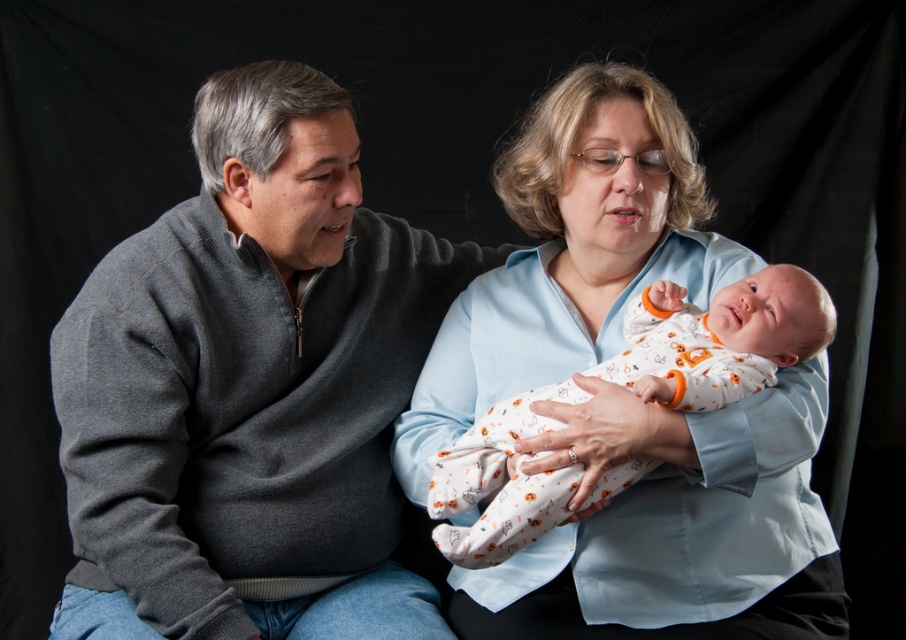
Between point (317, 493) and point (631, 595), which one is positioned in front?

Point (631, 595) is in front.

Does point (393, 584) come farther from viewer compared to point (589, 330)?

Yes, it is behind point (589, 330).

The image size is (906, 640). Identify the location of gray sweater at left. (249, 387).

Does light blue shirt at center have a greater height compared to white cotton onesie at center?

Yes, light blue shirt at center is taller than white cotton onesie at center.

Is light blue shirt at center thinner than white cotton onesie at center?

No.

Which is behind, point (735, 588) or point (564, 401)?

The point (735, 588) is more distant.

The width and height of the screenshot is (906, 640). Identify the location of light blue shirt at center. (675, 525).

Is gray sweater at left taller than white cotton onesie at center?

Correct, gray sweater at left is much taller as white cotton onesie at center.

Which is below, gray sweater at left or white cotton onesie at center?

white cotton onesie at center is below.

What do you see at coordinates (249, 387) in the screenshot? The image size is (906, 640). I see `gray sweater at left` at bounding box center [249, 387].

This screenshot has width=906, height=640. What are the coordinates of `gray sweater at left` in the screenshot? It's located at (249, 387).